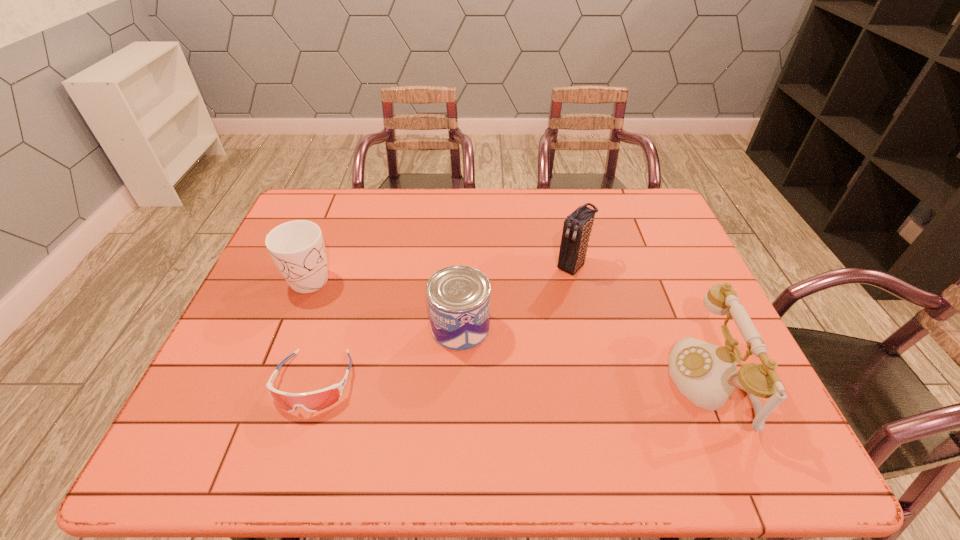
Where is `free space between the third object from right to left and the mug`? free space between the third object from right to left and the mug is located at coordinates (382, 305).

At what (x,y) coordinates should I click in order to perform the action: click on empty space between the second object from right to left and the third object from left to right. Please return your answer as a coordinate pair (x, y). This screenshot has width=960, height=540. Looking at the image, I should click on (516, 296).

Where is `empty location between the can and the clutch bag`? Image resolution: width=960 pixels, height=540 pixels. empty location between the can and the clutch bag is located at coordinates (516, 296).

Locate an element on the screen. free space between the rightmost object and the goggles is located at coordinates (512, 382).

You are a GUI agent. You are given a task and a screenshot of the screen. Output one action in this format:
    pyautogui.click(x=<x>, y=<y>)
    Task: Click on the empty space that is in between the mug and the rightmost object
    Image resolution: width=960 pixels, height=540 pixels.
    Given the screenshot: What is the action you would take?
    pyautogui.click(x=506, y=332)

You are a GUI agent. You are given a task and a screenshot of the screen. Output one action in this format:
    pyautogui.click(x=<x>, y=<y>)
    Task: Click on the object that stands as the closest to the telephone
    The height and width of the screenshot is (540, 960).
    Given the screenshot: What is the action you would take?
    pyautogui.click(x=577, y=227)

Locate which object ranks fourth in proximity to the clutch bag. Please provide its 2D coordinates. Your answer should be formatted as a tuple, i.e. [(x, y)], where the tuple contains the x and y coordinates of a point satisfying the conditions above.

[(297, 248)]

This screenshot has width=960, height=540. What are the coordinates of `vacant space that satisfies the following two spatial constraints: 1. on the front side of the mug; 2. on the dial of the telephone` in the screenshot? It's located at (262, 382).

Locate an element on the screen. vacant point that satisfies the following two spatial constraints: 1. on the front side of the can; 2. on the dial of the telephone is located at coordinates [x=458, y=382].

Locate an element on the screen. vacant space that satisfies the following two spatial constraints: 1. on the back side of the mug; 2. on the right side of the fourth object from left to right is located at coordinates (310, 266).